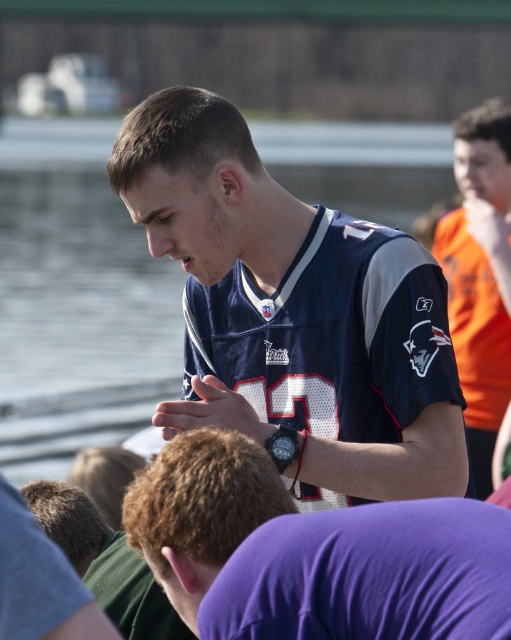
You are a photographer trying to capture the best shot of the blue jersey at center. Based on its position coordinates, where should you aim your camera?

The blue jersey at center is located at coordinates point 0.431 on the x axis and 0.939 on the y axis, so aim your camera at that point to capture it.

You are a photographer trying to capture a clear shot of the matte jersey at center and the matte blue jersey at center. Based on their positions, which one is closer to the camera?

The matte jersey at center is closer to the camera because it is in front of the matte blue jersey at center.

You are a photographer trying to capture a group photo of the matte jersey at center and the matte blue jersey at center. Since you want to ensure both are visible, which one should you place on the left side to avoid overlap?

The matte jersey at center is positioned on the right side of the matte blue jersey at center, so to avoid overlap, place the matte blue jersey at center on the left side.